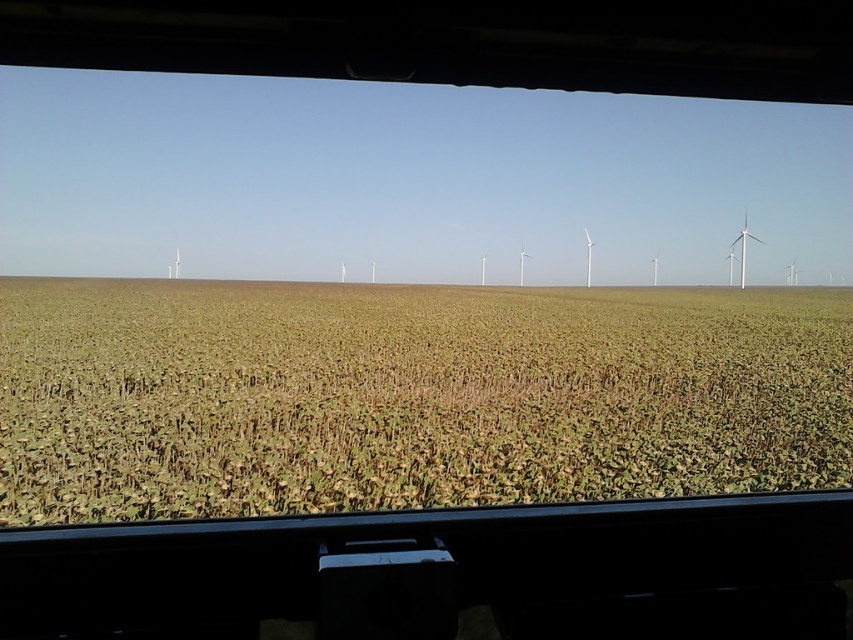
Is green matte wheat field at center above white matte wind turbine at right?

Incorrect, green matte wheat field at center is not positioned above white matte wind turbine at right.

Between green matte wheat field at center and white matte wind turbine at right, which one is positioned lower?

green matte wheat field at center is lower down.

Between point (569, 472) and point (741, 266), which one is positioned behind?

Positioned behind is point (741, 266).

I want to click on green matte wheat field at center, so click(x=409, y=396).